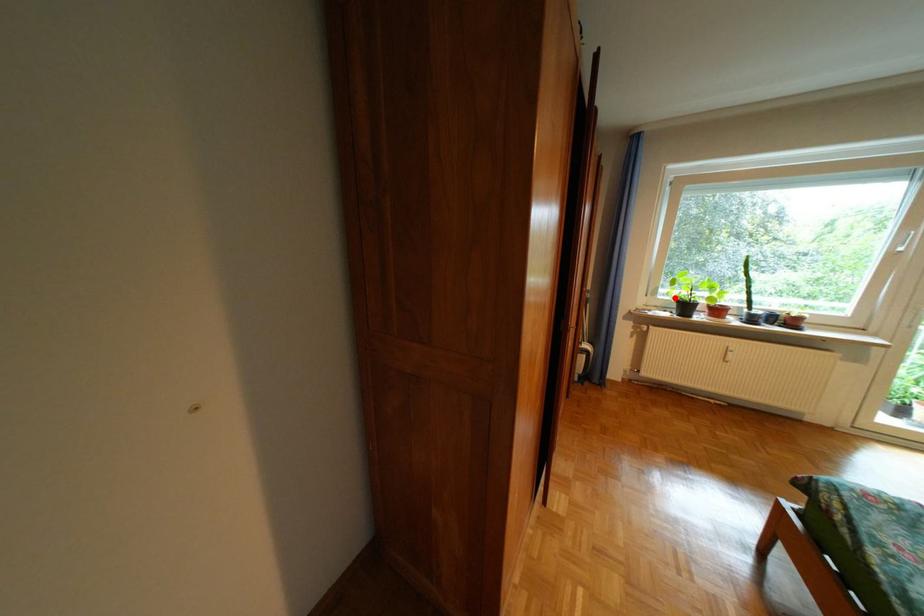
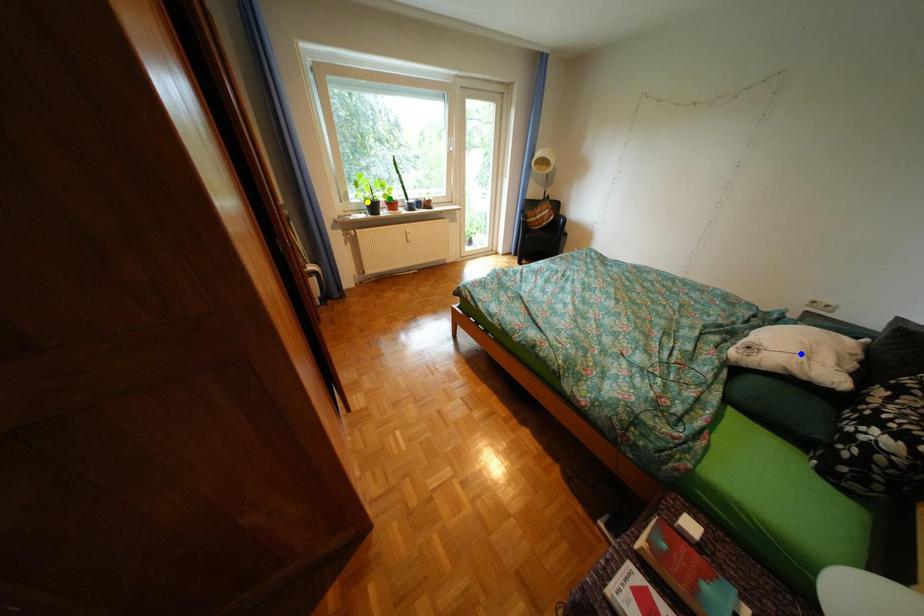
Question: I am providing you with two images of the same scene from different viewpoints. A red point is marked on the first image. You are given multiple points on the second image. Which spot in image 2 lines up with the point in image 1?

Choices:
 (A) blue point
 (B) green point
 (C) yellow point

Answer: (C)